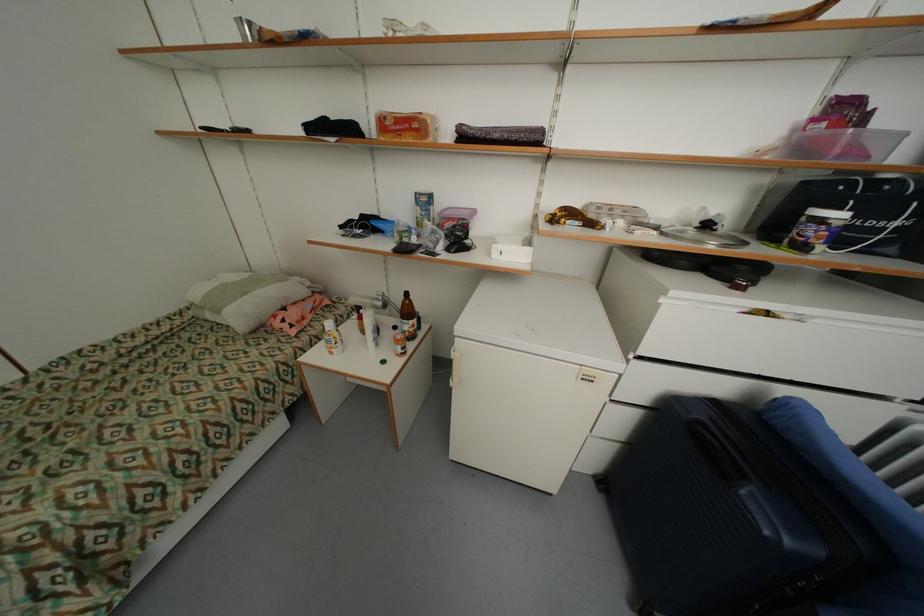
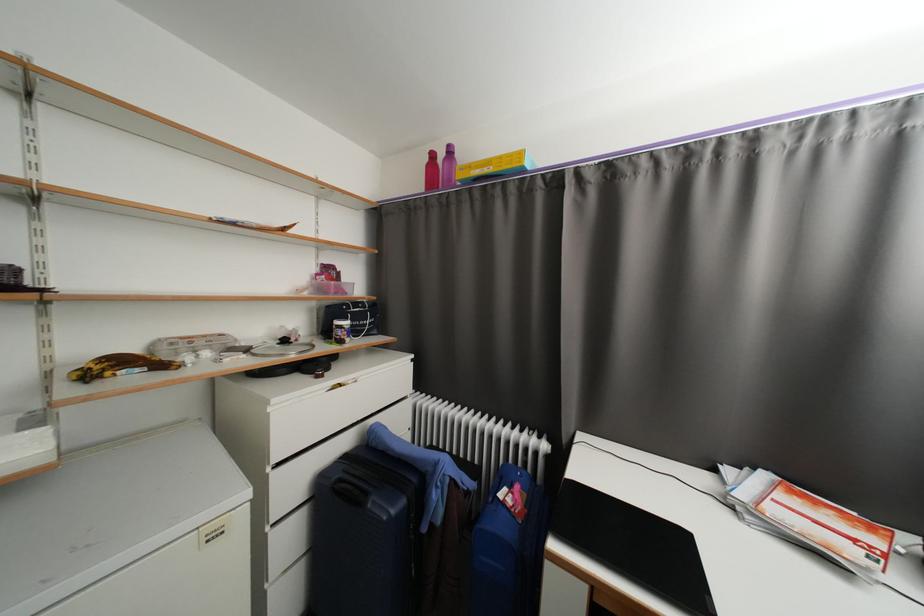
The point at (845, 217) is marked in the first image. Where is the corresponding point in the second image?

(353, 323)